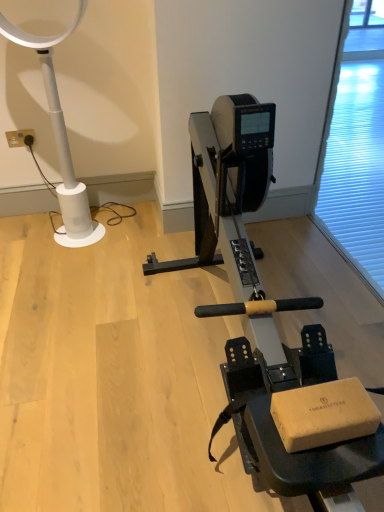
You are a GUI agent. You are given a task and a screenshot of the screen. Output one action in this format:
    pyautogui.click(x=<x>, y=<y>)
    Task: Click on the vacant space to the right of white plastic lamp at left
    The width and height of the screenshot is (384, 512).
    Given the screenshot: What is the action you would take?
    pyautogui.click(x=142, y=232)